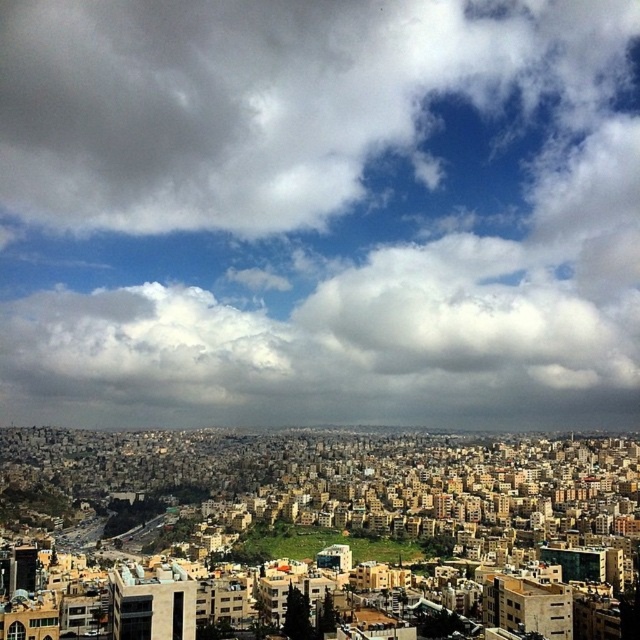
Which is behind, point (298, 401) or point (344, 534)?

The point (298, 401) is behind.

Consider the image. Is cloudy sky at upper center below green grassy hill at center?

Actually, cloudy sky at upper center is above green grassy hill at center.

Is point (316, 237) farther from camera compared to point (413, 556)?

Yes, point (316, 237) is farther from viewer.

Locate an element on the screen. This screenshot has height=640, width=640. cloudy sky at upper center is located at coordinates (320, 212).